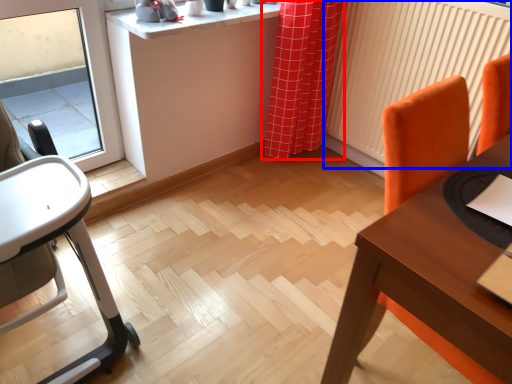
Question: Which object appears closest to the camera in this image, curtain (highlighted by a red box) or radiator (highlighted by a blue box)?

Choices:
 (A) curtain
 (B) radiator

Answer: (B)